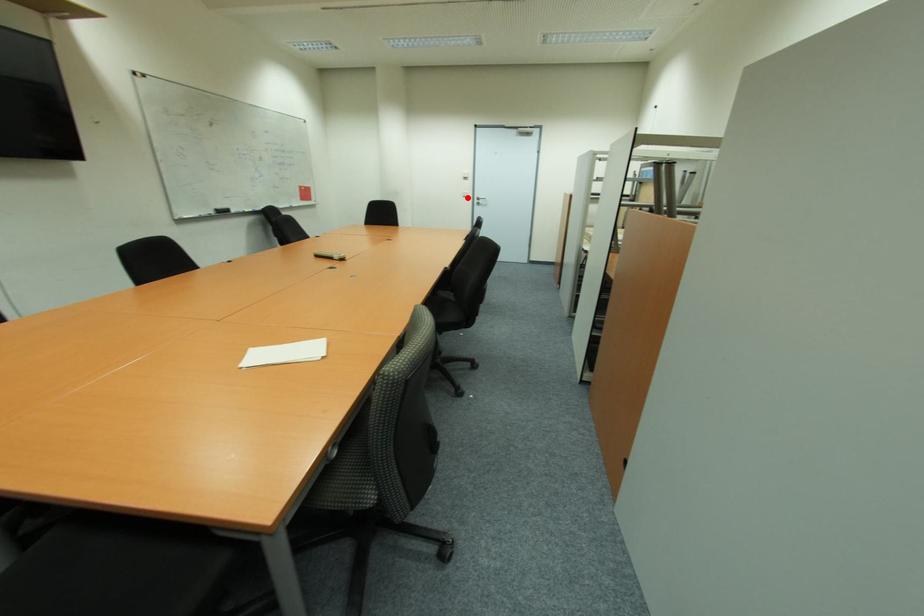
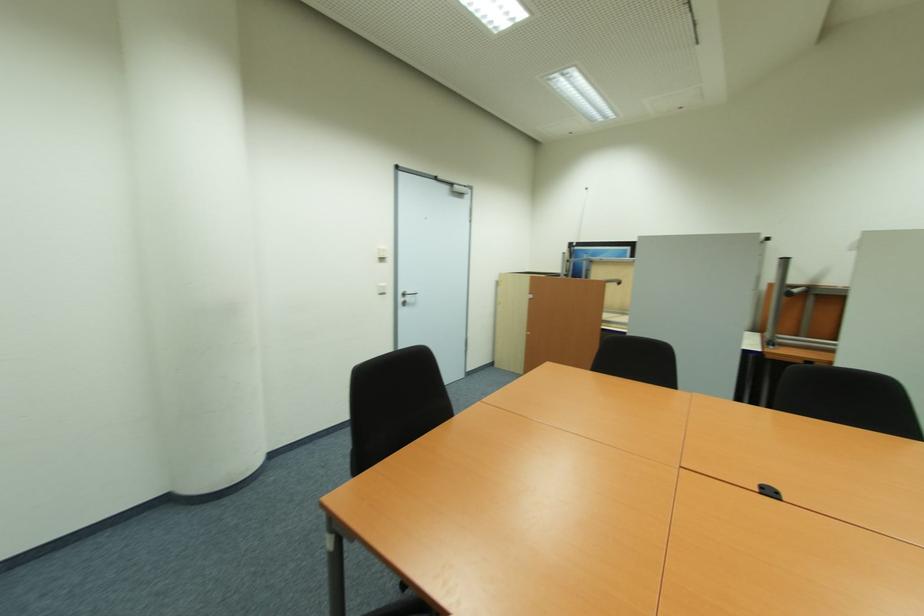
The point at the highlighted location is marked in the first image. Where is the corresponding point in the second image?

(383, 294)